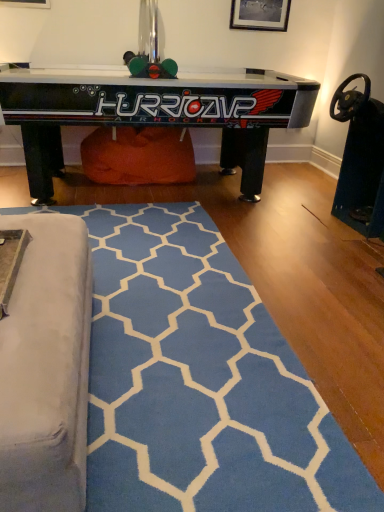
Question: Based on their positions, is wooden picture frame at upper center located to the left or right of blue soft rug at lower center?

Choices:
 (A) left
 (B) right

Answer: (B)

Question: Is wooden picture frame at upper center taller or shorter than blue soft rug at lower center?

Choices:
 (A) tall
 (B) short

Answer: (A)

Question: Based on their relative distances, which object is farther from the black glossy air hockey table at upper center?

Choices:
 (A) wooden picture frame at upper center
 (B) blue soft rug at lower center

Answer: (B)

Question: Which is nearer to the blue soft rug at lower center?

Choices:
 (A) wooden picture frame at upper center
 (B) black glossy air hockey table at upper center

Answer: (B)